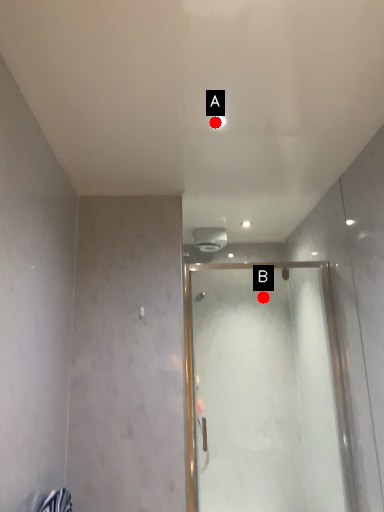
Question: Two points are circled on the image, labeled by A and B beside each circle. Among these points, which one is farthest from the camera?

Choices:
 (A) A is further
 (B) B is further

Answer: (B)